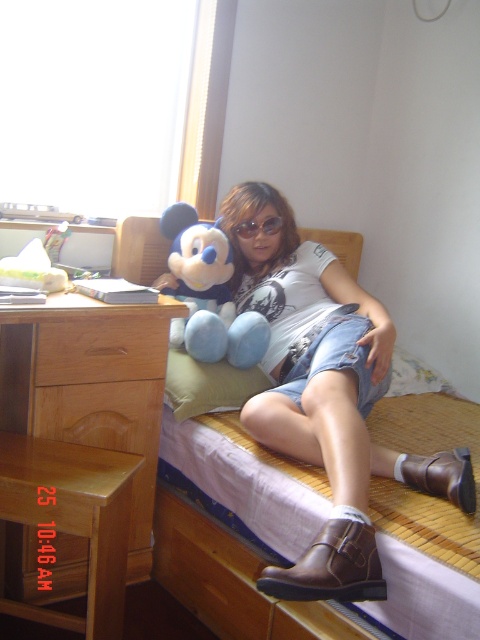
Question: Which of the following is the farthest from the observer?

Choices:
 (A) (319, 536)
 (B) (176, 237)
 (C) (276, 228)

Answer: (B)

Question: Is denim shorts at center bigger than blue plush toy at center?

Choices:
 (A) yes
 (B) no

Answer: (A)

Question: Which object is farther from the camera taking this photo?

Choices:
 (A) black plastic goggles at center
 (B) denim shorts at center

Answer: (A)

Question: Can you confirm if denim shorts at center is positioned to the right of blue plush toy at center?

Choices:
 (A) yes
 (B) no

Answer: (A)

Question: Which point appears farthest from the camera in this image?

Choices:
 (A) (225, 268)
 (B) (248, 232)
 (C) (317, 564)

Answer: (A)

Question: Does denim shorts at center have a smaller size compared to blue plush toy at center?

Choices:
 (A) no
 (B) yes

Answer: (A)